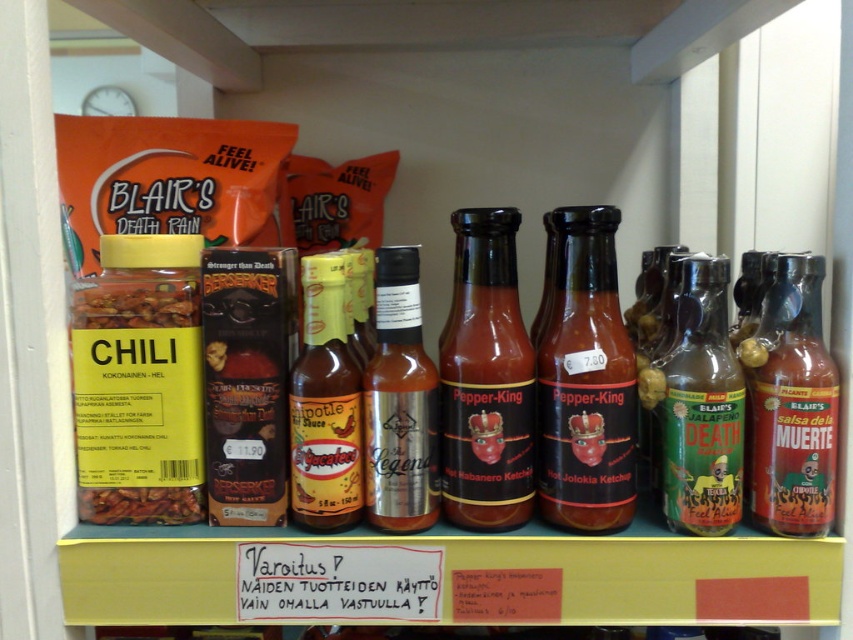
Question: Estimate the real-world distances between objects in this image. Which object is closer to the yellow matte hot sauce at center?

Choices:
 (A) green matte bottle at center-right
 (B) brown powder at center
 (C) translucent glass bottle at center right

Answer: (B)

Question: Which of these objects is positioned closest to the matte black pepper-king hot jolokia ketchup at center?

Choices:
 (A) matte glass bottle at center
 (B) translucent glass bottle at center right
 (C) silver metallic bottle at center
 (D) yellow matte hot sauce at center

Answer: (A)

Question: Does matte glass bottle at center appear under green matte bottle at center-right?

Choices:
 (A) no
 (B) yes

Answer: (A)

Question: Which is nearer to the green matte bottle at center-right?

Choices:
 (A) matte black pepper-king hot jolokia ketchup at center
 (B) translucent glass bottle at center right

Answer: (B)

Question: Can you confirm if matte glass bottle at center is thinner than green matte bottle at center-right?

Choices:
 (A) yes
 (B) no

Answer: (B)

Question: Does translucent glass bottle at center right lie in front of matte glass jar at center?

Choices:
 (A) yes
 (B) no

Answer: (A)